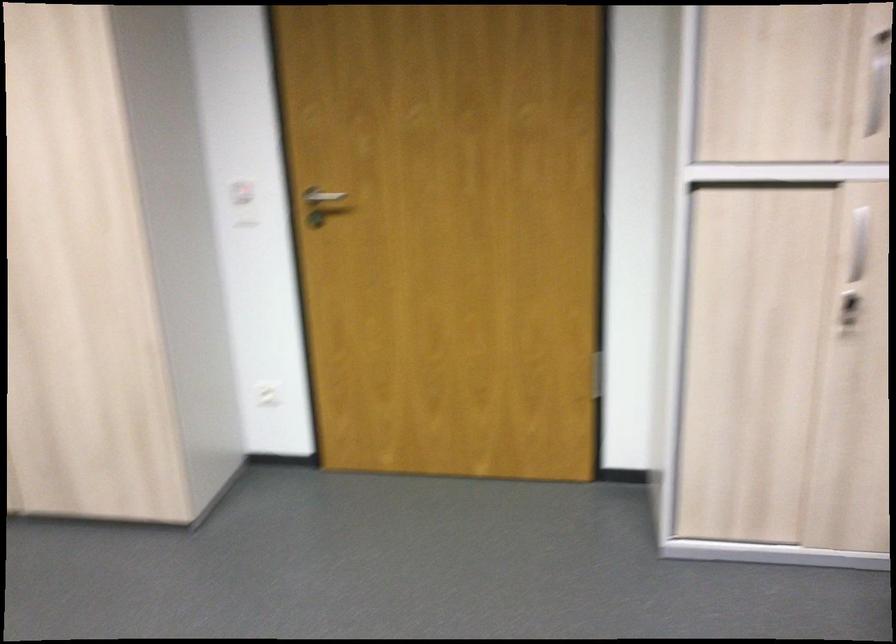
Find the location of a particular element. This screenshot has height=644, width=896. red wall switch is located at coordinates (240, 204).